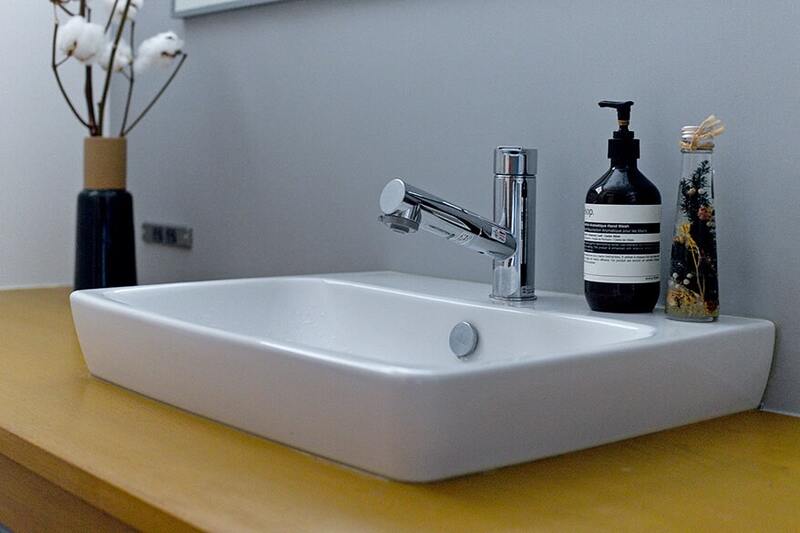
Identify the location of soap dispenser. The height and width of the screenshot is (533, 800). (622, 185).